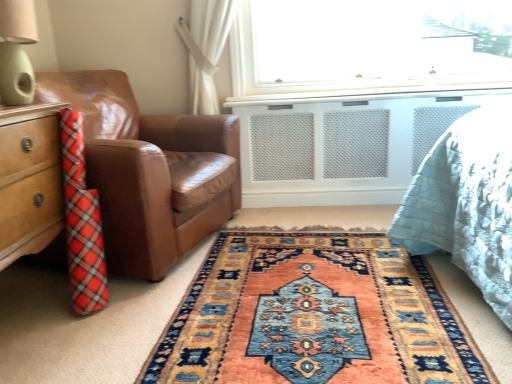
Question: Does carpet with intricate patterns at center appear on the right side of matte green lampshade at upper left?

Choices:
 (A) yes
 (B) no

Answer: (A)

Question: Would you consider carpet with intricate patterns at center to be distant from matte green lampshade at upper left?

Choices:
 (A) no
 (B) yes

Answer: (B)

Question: Can you confirm if carpet with intricate patterns at center is smaller than matte green lampshade at upper left?

Choices:
 (A) no
 (B) yes

Answer: (A)

Question: Considering the relative sizes of carpet with intricate patterns at center and matte green lampshade at upper left in the image provided, is carpet with intricate patterns at center thinner than matte green lampshade at upper left?

Choices:
 (A) yes
 (B) no

Answer: (B)

Question: Does carpet with intricate patterns at center have a lesser height compared to matte green lampshade at upper left?

Choices:
 (A) yes
 (B) no

Answer: (A)

Question: Is carpet with intricate patterns at center facing away from matte green lampshade at upper left?

Choices:
 (A) no
 (B) yes

Answer: (A)

Question: Can you confirm if matte green lampshade at upper left is positioned to the right of brown leather chair at left?

Choices:
 (A) no
 (B) yes

Answer: (A)

Question: Is matte green lampshade at upper left further to the viewer compared to brown leather chair at left?

Choices:
 (A) no
 (B) yes

Answer: (A)

Question: Is matte green lampshade at upper left oriented away from brown leather chair at left?

Choices:
 (A) yes
 (B) no

Answer: (B)

Question: Considering the relative sizes of matte green lampshade at upper left and brown leather chair at left in the image provided, is matte green lampshade at upper left bigger than brown leather chair at left?

Choices:
 (A) yes
 (B) no

Answer: (B)

Question: From a real-world perspective, is matte green lampshade at upper left physically below brown leather chair at left?

Choices:
 (A) no
 (B) yes

Answer: (A)

Question: Does matte green lampshade at upper left turn towards brown leather chair at left?

Choices:
 (A) yes
 (B) no

Answer: (B)

Question: Is brown leather chair at left to the left of matte green lampshade at upper left from the viewer's perspective?

Choices:
 (A) yes
 (B) no

Answer: (B)